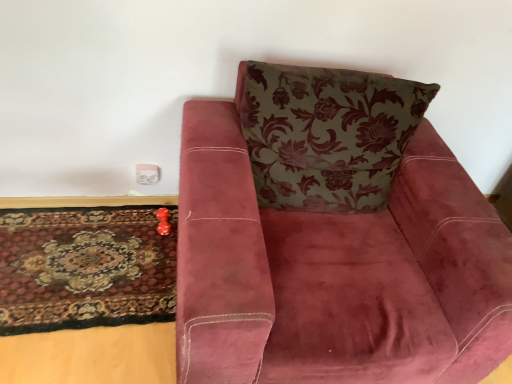
Question: Is white plastic electric outlet at lower left positioned beyond the bounds of carpeted rug at lower left?

Choices:
 (A) no
 (B) yes

Answer: (B)

Question: Does white plastic electric outlet at lower left touch carpeted rug at lower left?

Choices:
 (A) no
 (B) yes

Answer: (A)

Question: Is white plastic electric outlet at lower left positioned behind carpeted rug at lower left?

Choices:
 (A) no
 (B) yes

Answer: (B)

Question: Can you confirm if white plastic electric outlet at lower left is wider than carpeted rug at lower left?

Choices:
 (A) yes
 (B) no

Answer: (B)

Question: From the image's perspective, does white plastic electric outlet at lower left appear higher than carpeted rug at lower left?

Choices:
 (A) yes
 (B) no

Answer: (A)

Question: From a real-world perspective, is white plastic electric outlet at lower left beneath carpeted rug at lower left?

Choices:
 (A) yes
 (B) no

Answer: (B)

Question: Is the surface of white plastic electric outlet at lower left in direct contact with velvet maroon armchair at center?

Choices:
 (A) yes
 (B) no

Answer: (B)

Question: Can you confirm if white plastic electric outlet at lower left is wider than velvet maroon armchair at center?

Choices:
 (A) no
 (B) yes

Answer: (A)

Question: Is white plastic electric outlet at lower left surrounding velvet maroon armchair at center?

Choices:
 (A) no
 (B) yes

Answer: (A)

Question: Is the position of white plastic electric outlet at lower left more distant than that of velvet maroon armchair at center?

Choices:
 (A) yes
 (B) no

Answer: (A)

Question: Is white plastic electric outlet at lower left outside of velvet maroon armchair at center?

Choices:
 (A) yes
 (B) no

Answer: (A)

Question: From the image's perspective, does white plastic electric outlet at lower left appear higher than velvet maroon armchair at center?

Choices:
 (A) no
 (B) yes

Answer: (B)

Question: From a real-world perspective, is carpeted rug at lower left over white plastic electric outlet at lower left?

Choices:
 (A) no
 (B) yes

Answer: (A)